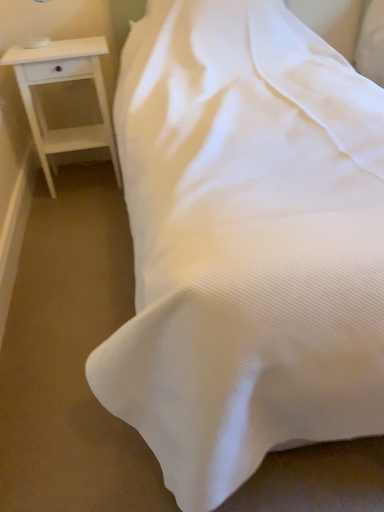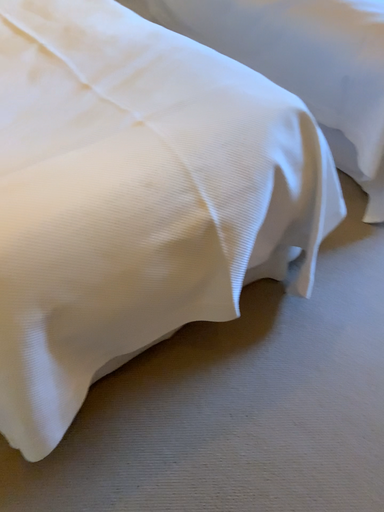
Question: How did the camera likely rotate when shooting the video?

Choices:
 (A) rotated downward
 (B) rotated upward

Answer: (A)